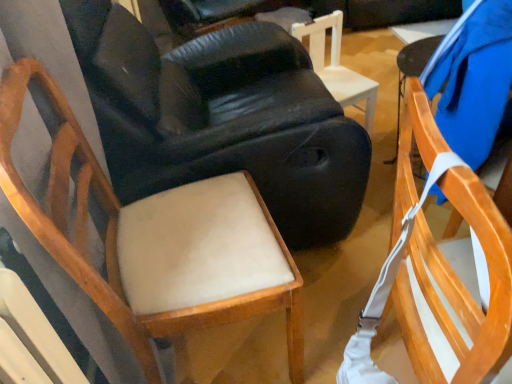
Identify the location of light brown wood chair at left, which appears as the 4th chair when viewed from the right. (154, 240).

Measure the distance between point (125, 216) and camera.

Point (125, 216) and camera are 3.37 feet apart.

Measure the distance between wooden chair with white straps at right, the fourth chair viewed from the left, and camera.

A distance of 17.54 inches exists between wooden chair with white straps at right, the fourth chair viewed from the left, and camera.

Identify the location of wooden chair with white straps at right, the fourth chair viewed from the left. The height and width of the screenshot is (384, 512). (456, 291).

How much space does white wood chair at center, which is counted as the 3th chair, starting from the left, occupy vertically?

50.41 centimeters.

The image size is (512, 384). I want to click on light brown wood chair at left, which appears as the 4th chair when viewed from the right, so click(154, 240).

Would you consider wooden chair with white straps at right, the fourth chair viewed from the left, to be distant from light beige fabric chair at center, the third chair when ordered from right to left?

That's not correct — wooden chair with white straps at right, the fourth chair viewed from the left, is a little close to light beige fabric chair at center, the third chair when ordered from right to left.

In the scene shown: Is wooden chair with white straps at right, the first chair positioned from the right, outside of light beige fabric chair at center, which is the 2th chair in left-to-right order?

Yes, wooden chair with white straps at right, the first chair positioned from the right, is not within light beige fabric chair at center, which is the 2th chair in left-to-right order.

Locate an element on the screen. The height and width of the screenshot is (384, 512). the 2nd chair positioned above the wooden chair with white straps at right, the first chair positioned from the right (from the image's perspective) is located at coordinates (222, 118).

Based on the photo, from a real-world perspective, is light brown wood chair at left, which appears as the 4th chair when viewed from the right, physically above white wood chair at center, which is counted as the 3th chair, starting from the left?

Yes, from a real-world perspective, light brown wood chair at left, which appears as the 4th chair when viewed from the right, is above white wood chair at center, which is counted as the 3th chair, starting from the left.

Does light brown wood chair at left, which ranks as the first chair in left-to-right order, have a lesser height compared to white wood chair at center, marked as the second chair in a right-to-left arrangement?

In fact, light brown wood chair at left, which ranks as the first chair in left-to-right order, may be taller than white wood chair at center, marked as the second chair in a right-to-left arrangement.

Consider the image. Is light brown wood chair at left, which ranks as the first chair in left-to-right order, positioned with its back to white wood chair at center, which is counted as the 3th chair, starting from the left?

No, light brown wood chair at left, which ranks as the first chair in left-to-right order, is not facing away from white wood chair at center, which is counted as the 3th chair, starting from the left.

In the scene shown: Considering the positions of objects light brown wood chair at left, which appears as the 4th chair when viewed from the right, and white wood chair at center, which is counted as the 3th chair, starting from the left, in the image provided, who is in front, light brown wood chair at left, which appears as the 4th chair when viewed from the right, or white wood chair at center, which is counted as the 3th chair, starting from the left,?

light brown wood chair at left, which appears as the 4th chair when viewed from the right.

Who is shorter, white wood chair at center, marked as the second chair in a right-to-left arrangement, or wooden chair with white straps at right, the first chair positioned from the right?

white wood chair at center, marked as the second chair in a right-to-left arrangement.

Which of these two, white wood chair at center, marked as the second chair in a right-to-left arrangement, or wooden chair with white straps at right, the fourth chair viewed from the left, is wider?

With larger width is wooden chair with white straps at right, the fourth chair viewed from the left.

Locate an element on the screen. This screenshot has height=384, width=512. the 1st chair directly above the white wood chair at center, marked as the second chair in a right-to-left arrangement (from a real-world perspective) is located at coordinates (456, 291).

Who is more distant, light brown wood chair at left, which appears as the 4th chair when viewed from the right, or wooden chair with white straps at right, the fourth chair viewed from the left?

Positioned behind is light brown wood chair at left, which appears as the 4th chair when viewed from the right.

From the image's perspective, between light brown wood chair at left, which ranks as the first chair in left-to-right order, and wooden chair with white straps at right, the first chair positioned from the right, which one is located above?

light brown wood chair at left, which ranks as the first chair in left-to-right order, is shown above in the image.

From the picture: Are light brown wood chair at left, which ranks as the first chair in left-to-right order, and wooden chair with white straps at right, the first chair positioned from the right, located far from each other?

Actually, light brown wood chair at left, which ranks as the first chair in left-to-right order, and wooden chair with white straps at right, the first chair positioned from the right, are a little close together.

Considering the sizes of objects light brown wood chair at left, which ranks as the first chair in left-to-right order, and wooden chair with white straps at right, the first chair positioned from the right, in the image provided, who is thinner, light brown wood chair at left, which ranks as the first chair in left-to-right order, or wooden chair with white straps at right, the first chair positioned from the right,?

Thinner between the two is light brown wood chair at left, which ranks as the first chair in left-to-right order.

Could you tell me if white wood chair at center, which is counted as the 3th chair, starting from the left, is turned towards light beige fabric chair at center, which is the 2th chair in left-to-right order?

No, white wood chair at center, which is counted as the 3th chair, starting from the left, is not turned towards light beige fabric chair at center, which is the 2th chair in left-to-right order.

What's the angular difference between white wood chair at center, which is counted as the 3th chair, starting from the left, and light beige fabric chair at center, the third chair when ordered from right to left,'s facing directions?

They differ by 70.9 degrees in their facing directions.

Is white wood chair at center, which is counted as the 3th chair, starting from the left, in front of or behind light beige fabric chair at center, which is the 2th chair in left-to-right order, in the image?

white wood chair at center, which is counted as the 3th chair, starting from the left, is behind light beige fabric chair at center, which is the 2th chair in left-to-right order.

Considering the relative sizes of white wood chair at center, marked as the second chair in a right-to-left arrangement, and light beige fabric chair at center, which is the 2th chair in left-to-right order, in the image provided, is white wood chair at center, marked as the second chair in a right-to-left arrangement, thinner than light beige fabric chair at center, which is the 2th chair in left-to-right order,?

Yes.

Which of these two, wooden chair with white straps at right, the first chair positioned from the right, or light brown wood chair at left, which ranks as the first chair in left-to-right order, is bigger?

Bigger between the two is wooden chair with white straps at right, the first chair positioned from the right.

Considering the relative sizes of wooden chair with white straps at right, the fourth chair viewed from the left, and light brown wood chair at left, which ranks as the first chair in left-to-right order, in the image provided, is wooden chair with white straps at right, the fourth chair viewed from the left, thinner than light brown wood chair at left, which ranks as the first chair in left-to-right order,?

In fact, wooden chair with white straps at right, the fourth chair viewed from the left, might be wider than light brown wood chair at left, which ranks as the first chair in left-to-right order.

Is the surface of white wood chair at center, marked as the second chair in a right-to-left arrangement, in direct contact with light brown wood chair at left, which appears as the 4th chair when viewed from the right?

white wood chair at center, marked as the second chair in a right-to-left arrangement, is not next to light brown wood chair at left, which appears as the 4th chair when viewed from the right, and they're not touching.

Does white wood chair at center, marked as the second chair in a right-to-left arrangement, turn towards light brown wood chair at left, which appears as the 4th chair when viewed from the right?

No, white wood chair at center, marked as the second chair in a right-to-left arrangement, is not turned towards light brown wood chair at left, which appears as the 4th chair when viewed from the right.

The width and height of the screenshot is (512, 384). I want to click on chair that is the 2nd object to the left of the white wood chair at center, marked as the second chair in a right-to-left arrangement, starting at the anchor, so click(154, 240).

Is white wood chair at center, which is counted as the 3th chair, starting from the left, positioned in front of light brown wood chair at left, which appears as the 4th chair when viewed from the right?

No, it is behind light brown wood chair at left, which appears as the 4th chair when viewed from the right.

From a real-world perspective, which chair is the 2nd one underneath the light beige fabric chair at center, which is the 2th chair in left-to-right order? Please provide its 2D coordinates.

[(456, 291)]

Where is `the 2nd chair above the light brown wood chair at left, which ranks as the first chair in left-to-right order (from the image's perspective)`? the 2nd chair above the light brown wood chair at left, which ranks as the first chair in left-to-right order (from the image's perspective) is located at coordinates (337, 66).

Estimate the real-world distances between objects in this image. Which object is closer to white wood chair at center, marked as the second chair in a right-to-left arrangement, light brown wood chair at left, which ranks as the first chair in left-to-right order, or light beige fabric chair at center, the third chair when ordered from right to left?

Based on the image, light beige fabric chair at center, the third chair when ordered from right to left, appears to be nearer to white wood chair at center, marked as the second chair in a right-to-left arrangement.

Looking at the image, which one is located closer to wooden chair with white straps at right, the fourth chair viewed from the left, white wood chair at center, which is counted as the 3th chair, starting from the left, or light beige fabric chair at center, the third chair when ordered from right to left?

The object closer to wooden chair with white straps at right, the fourth chair viewed from the left, is light beige fabric chair at center, the third chair when ordered from right to left.

Based on their spatial positions, is wooden chair with white straps at right, the first chair positioned from the right, or light beige fabric chair at center, which is the 2th chair in left-to-right order, further from light brown wood chair at left, which appears as the 4th chair when viewed from the right?

The object further to light brown wood chair at left, which appears as the 4th chair when viewed from the right, is wooden chair with white straps at right, the first chair positioned from the right.

Looking at the image, which one is located closer to light brown wood chair at left, which appears as the 4th chair when viewed from the right, light beige fabric chair at center, which is the 2th chair in left-to-right order, or wooden chair with white straps at right, the fourth chair viewed from the left?

light beige fabric chair at center, which is the 2th chair in left-to-right order, is positioned closer to the anchor light brown wood chair at left, which appears as the 4th chair when viewed from the right.

Which object lies nearer to the anchor point white wood chair at center, which is counted as the 3th chair, starting from the left, wooden chair with white straps at right, the first chair positioned from the right, or light beige fabric chair at center, the third chair when ordered from right to left?

The object closer to white wood chair at center, which is counted as the 3th chair, starting from the left, is light beige fabric chair at center, the third chair when ordered from right to left.

When comparing their distances from light brown wood chair at left, which ranks as the first chair in left-to-right order, does wooden chair with white straps at right, the fourth chair viewed from the left, or white wood chair at center, marked as the second chair in a right-to-left arrangement, seem closer?

wooden chair with white straps at right, the fourth chair viewed from the left, is positioned closer to the anchor light brown wood chair at left, which ranks as the first chair in left-to-right order.

In the scene shown: From the image, which object appears to be nearer to light brown wood chair at left, which appears as the 4th chair when viewed from the right, white wood chair at center, which is counted as the 3th chair, starting from the left, or wooden chair with white straps at right, the fourth chair viewed from the left?

wooden chair with white straps at right, the fourth chair viewed from the left, is positioned closer to the anchor light brown wood chair at left, which appears as the 4th chair when viewed from the right.

Which object lies further to the anchor point white wood chair at center, marked as the second chair in a right-to-left arrangement, light brown wood chair at left, which appears as the 4th chair when viewed from the right, or wooden chair with white straps at right, the first chair positioned from the right?

wooden chair with white straps at right, the first chair positioned from the right, is positioned further to the anchor white wood chair at center, marked as the second chair in a right-to-left arrangement.

Image resolution: width=512 pixels, height=384 pixels. Find the location of `chair between light brown wood chair at left, which ranks as the first chair in left-to-right order, and white wood chair at center, which is counted as the 3th chair, starting from the left, along the z-axis`. chair between light brown wood chair at left, which ranks as the first chair in left-to-right order, and white wood chair at center, which is counted as the 3th chair, starting from the left, along the z-axis is located at coordinates (222, 118).